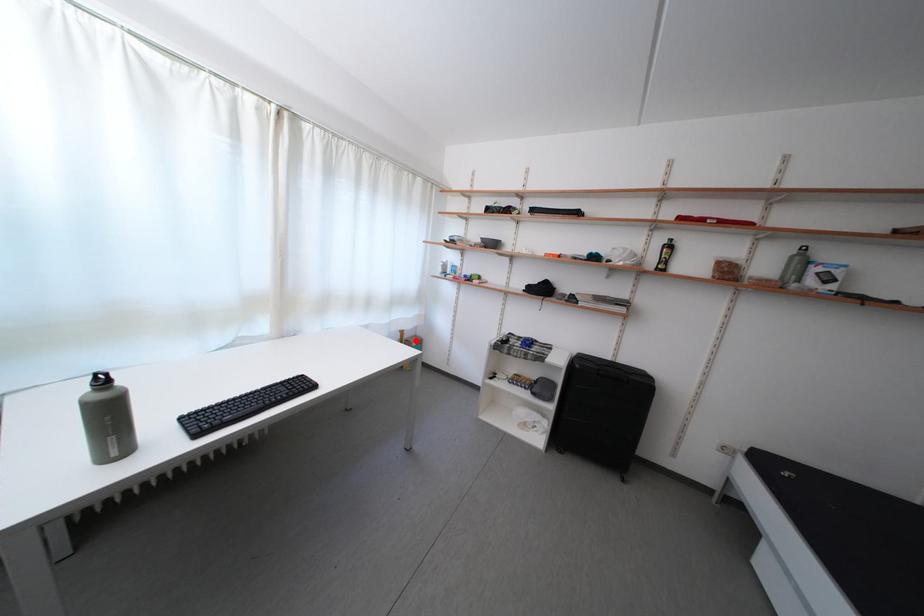
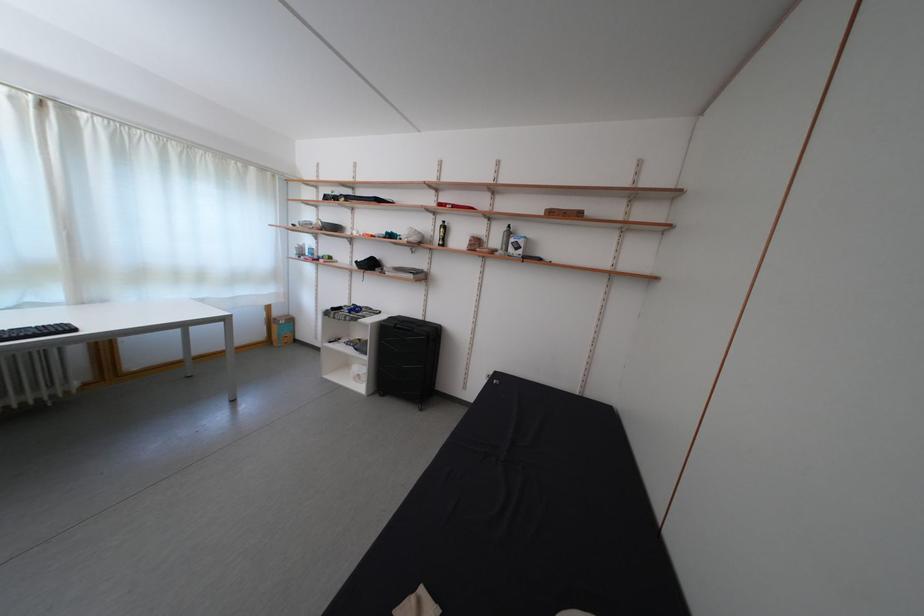
Locate, in the second image, the point that corresponds to the highlighted location in the first image.

(285, 320)